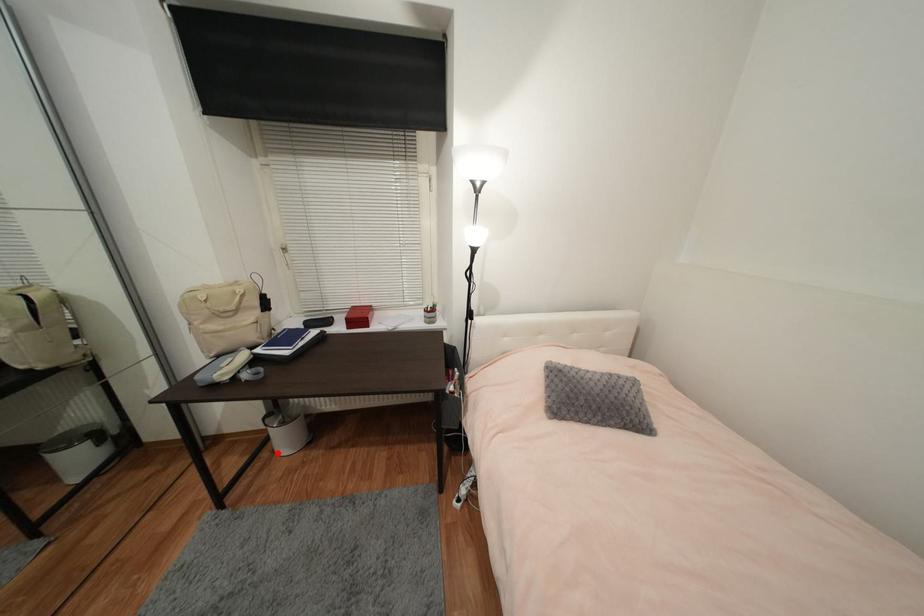
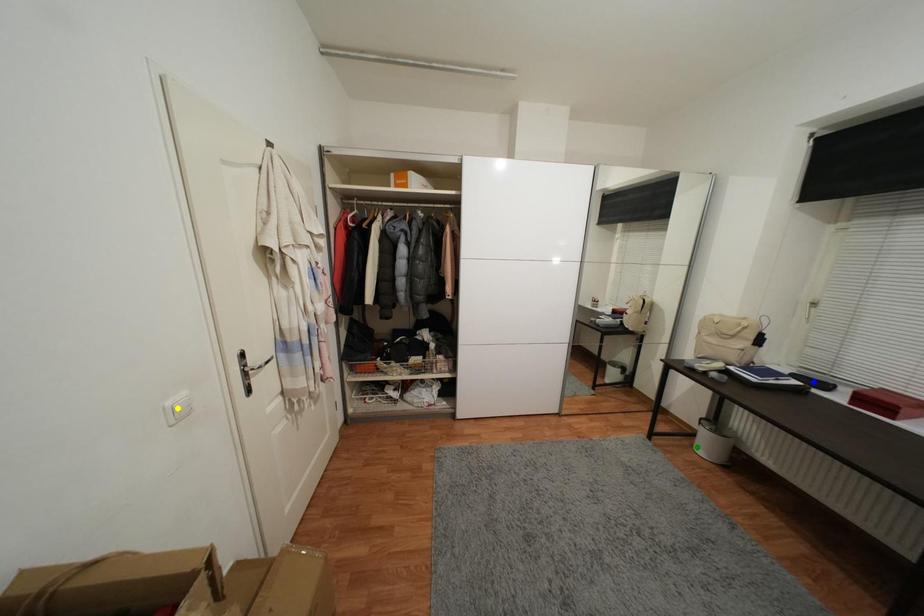
Question: I am providing you with two images of the same scene from different viewpoints. A red point is marked on the first image. You are given multiple points on the second image. Which point in image 2 represents the same 3d spot as the red point in image 1?

Choices:
 (A) yellow point
 (B) green point
 (C) blue point

Answer: (B)